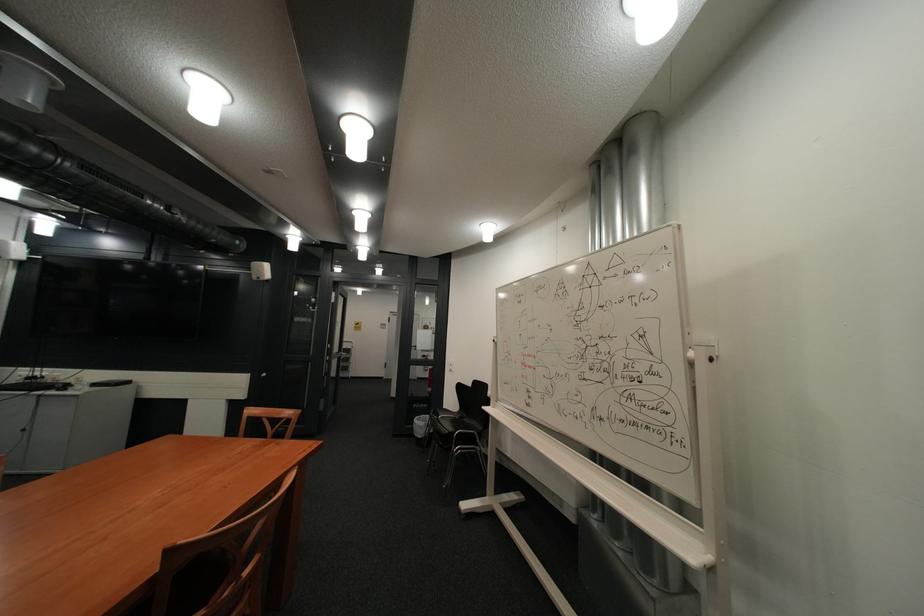
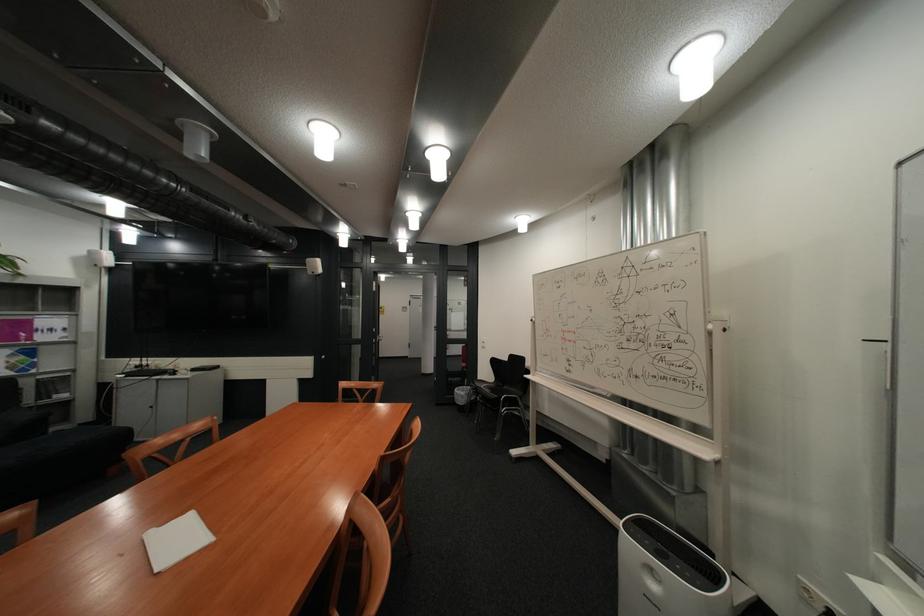
What movement of the cameraman would produce the second image?

The cameraman walked toward left, backward.